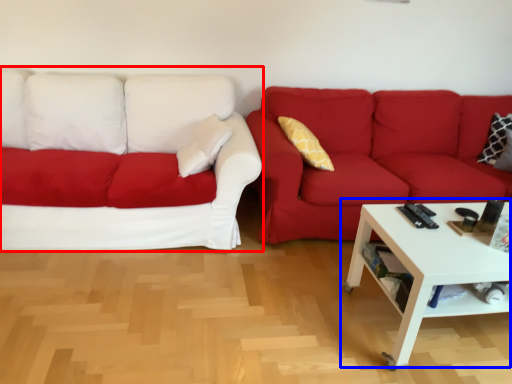
Question: Which point is closer to the camera, studio couch (highlighted by a red box) or coffee table (highlighted by a blue box)?

Choices:
 (A) studio couch
 (B) coffee table

Answer: (B)